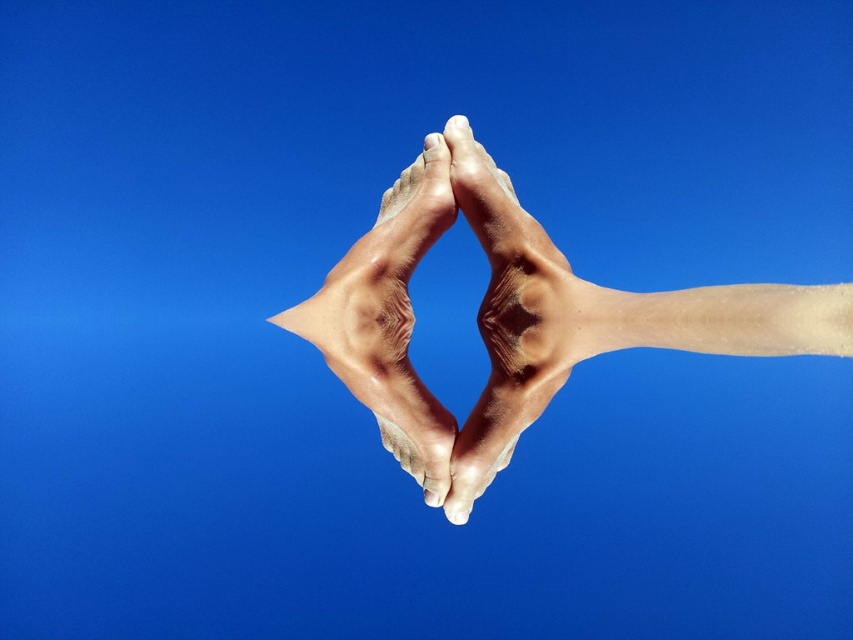
Is smooth skin feet at center thinner than smooth skin hand at center?

No.

Who is positioned more to the right, smooth skin feet at center or smooth skin hand at center?

smooth skin feet at center

Who is more distant from viewer, [651,317] or [485,472]?

Positioned behind is point [485,472].

At what (x,y) coordinates should I click in order to perform the action: click on smooth skin feet at center. Please return your answer as a coordinate pair (x, y). This screenshot has width=853, height=640. Looking at the image, I should click on (518, 310).